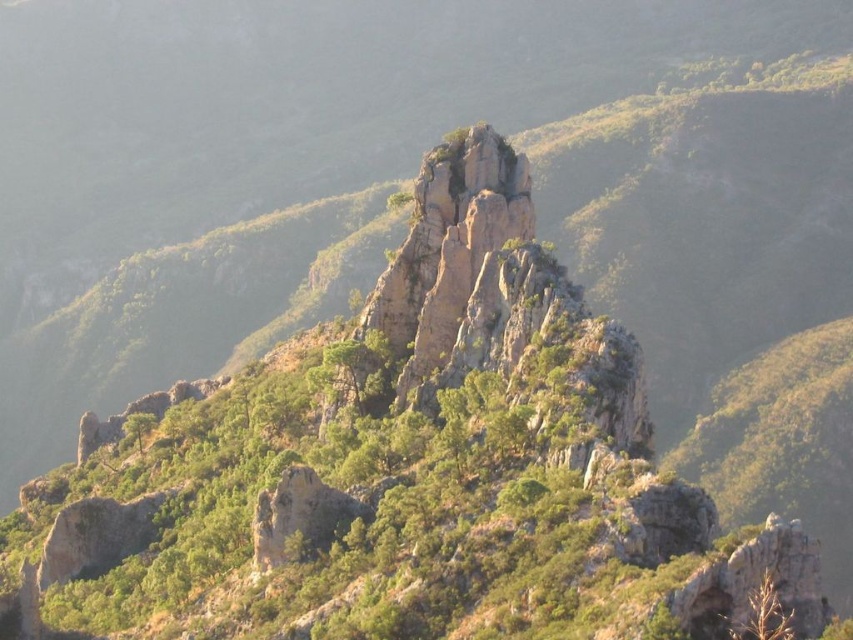
Does rugged stone rock at center have a greater width compared to rough textured rock at center?

Yes, rugged stone rock at center is wider than rough textured rock at center.

Who is shorter, rugged stone rock at center or rough textured rock at center?

rough textured rock at center

Locate an element on the screen. rugged stone rock at center is located at coordinates (447, 248).

Image resolution: width=853 pixels, height=640 pixels. I want to click on rugged stone rock at center, so click(x=447, y=248).